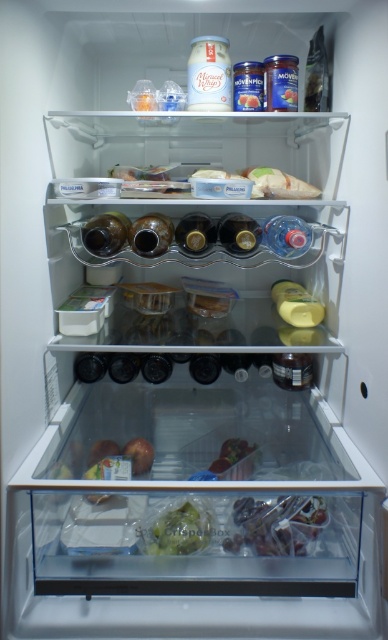
Who is higher up, green matte crisper box at lower center or shiny plastic container at center?

Positioned higher is shiny plastic container at center.

Is green matte crisper box at lower center closer to the viewer compared to shiny plastic container at center?

Yes, green matte crisper box at lower center is in front of shiny plastic container at center.

Is point (204, 516) less distant than point (226, 444)?

Yes, point (204, 516) is in front of point (226, 444).

You are a GUI agent. You are given a task and a screenshot of the screen. Output one action in this format:
    pyautogui.click(x=<x>, y=<y>)
    Task: Click on the green matte crisper box at lower center
    
    Given the screenshot: What is the action you would take?
    pyautogui.click(x=178, y=529)

Is point (296, 504) in front of point (157, 536)?

That is False.

Can you confirm if translucent plastic bag at lower center is positioned to the right of green matte crisper box at lower center?

Yes, translucent plastic bag at lower center is to the right of green matte crisper box at lower center.

Between point (245, 525) and point (206, 544), which one is positioned behind?

The point (245, 525) is behind.

Identify the location of translucent plastic bag at lower center. The image size is (388, 640). (277, 524).

Which is below, translucent plastic bag at lower center or shiny plastic container at center?

translucent plastic bag at lower center

Where is `translucent plastic bag at lower center`? The height and width of the screenshot is (640, 388). translucent plastic bag at lower center is located at coordinates (277, 524).

Where is `translucent plastic bag at lower center`? The width and height of the screenshot is (388, 640). translucent plastic bag at lower center is located at coordinates (277, 524).